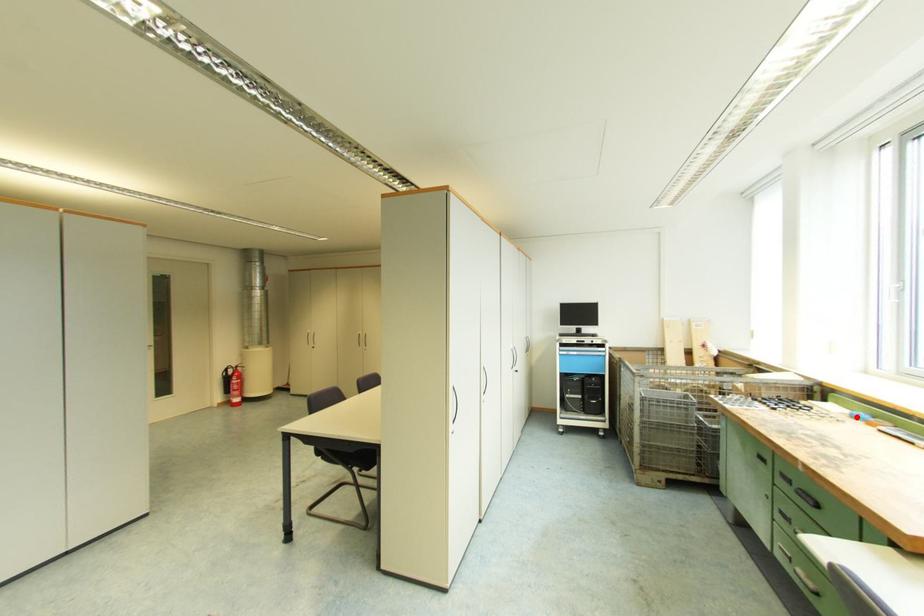
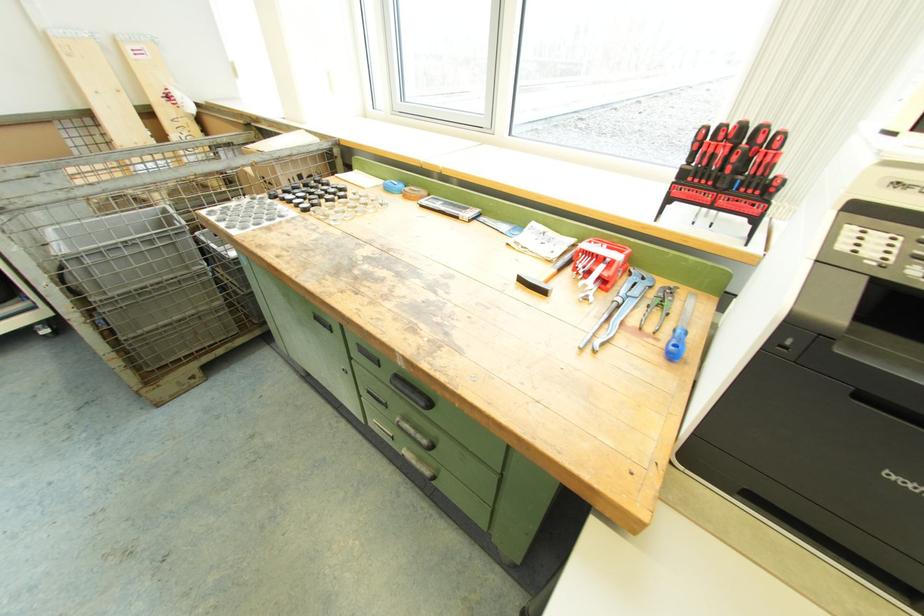
Find the pixel in the second image that matches the highlighted location in the first image.

(391, 188)